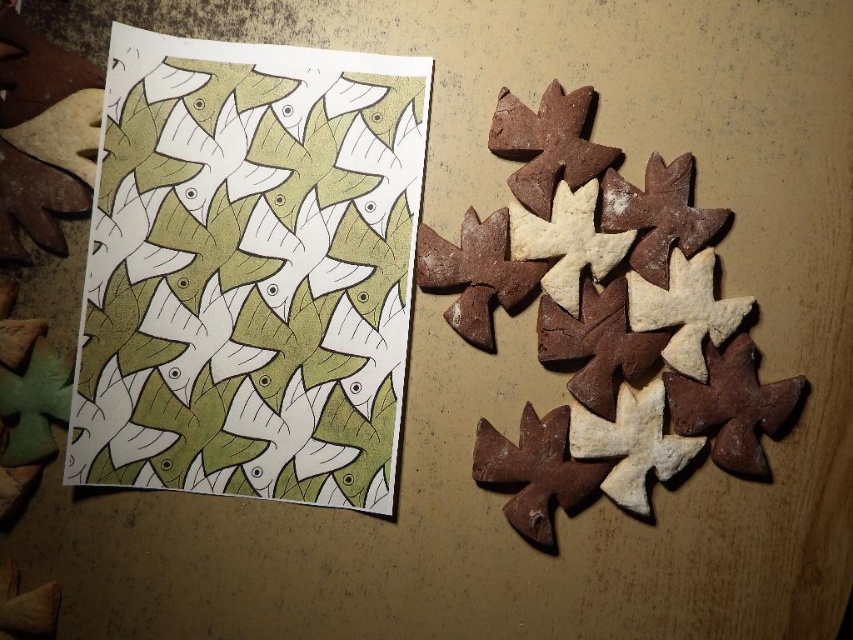
Question: Where is green paper at upper left located in relation to brown crumbly gingerbread at right in the image?

Choices:
 (A) right
 (B) left

Answer: (B)

Question: Can you confirm if green paper at upper left is positioned to the left of brown crumbly gingerbread at right?

Choices:
 (A) no
 (B) yes

Answer: (B)

Question: Among these points, which one is nearest to the camera?

Choices:
 (A) (310, 193)
 (B) (503, 132)

Answer: (B)

Question: Does green paper at upper left have a greater width compared to brown crumbly gingerbread at right?

Choices:
 (A) yes
 (B) no

Answer: (B)

Question: Which point is farther to the camera?

Choices:
 (A) (224, 157)
 (B) (498, 468)

Answer: (B)

Question: Which point appears closest to the camera in this image?

Choices:
 (A) (647, 417)
 (B) (161, 474)

Answer: (A)